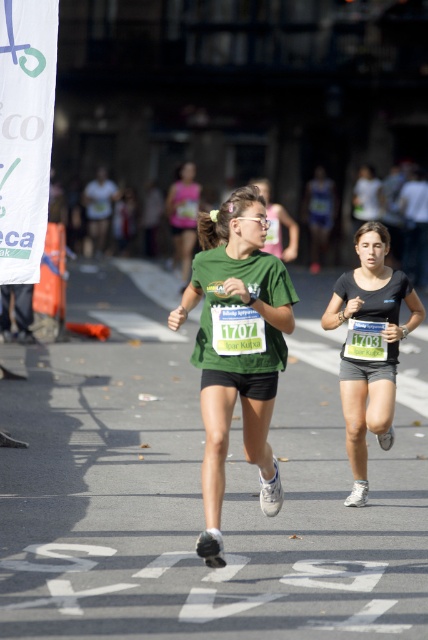
Question: Which object is positioned farthest from the matte green t-shirt at center?

Choices:
 (A) black matte shorts at center
 (B) green matte shirt at center

Answer: (B)

Question: Does green matte shirt at center have a lesser width compared to black matte shorts at center?

Choices:
 (A) no
 (B) yes

Answer: (B)

Question: Estimate the real-world distances between objects in this image. Which object is farther from the green matte shirt at center?

Choices:
 (A) matte green t-shirt at center
 (B) black matte shorts at center

Answer: (A)

Question: Which point is farther to the camera?

Choices:
 (A) (395, 285)
 (B) (256, 289)
 (C) (180, 170)

Answer: (C)

Question: Does black matte shorts at center appear on the left side of matte green t-shirt at center?

Choices:
 (A) yes
 (B) no

Answer: (B)

Question: Does green matte shirt at center have a smaller size compared to black matte shorts at center?

Choices:
 (A) no
 (B) yes

Answer: (A)